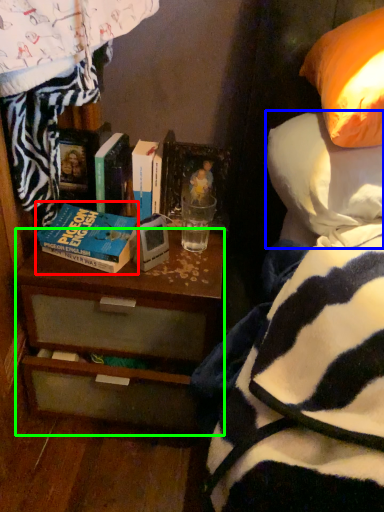
Question: Which is nearer to the book (highlighted by a red box)? pillow (highlighted by a blue box) or desk (highlighted by a green box).

Choices:
 (A) pillow
 (B) desk

Answer: (B)